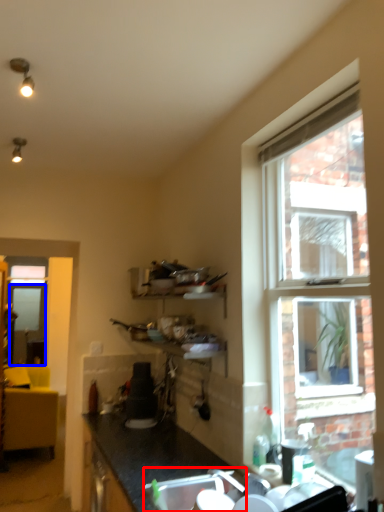
Question: Which of the following is the farthest to the observer, sink (highlighted by a red box) or screen door (highlighted by a blue box)?

Choices:
 (A) sink
 (B) screen door

Answer: (B)